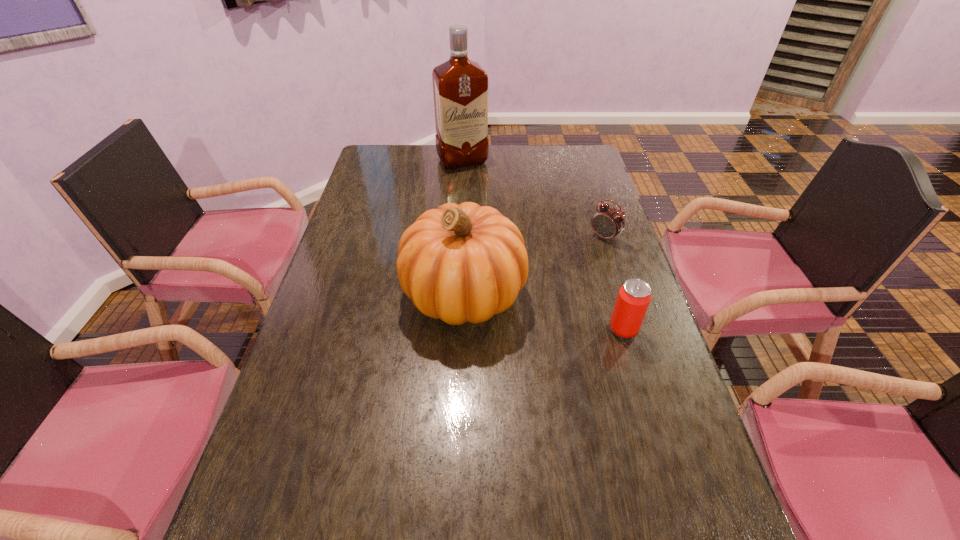
Where is `free point at the far left corner`? This screenshot has height=540, width=960. free point at the far left corner is located at coordinates (384, 152).

The width and height of the screenshot is (960, 540). I want to click on vacant region at the far right corner, so 561,160.

This screenshot has width=960, height=540. Find the location of `vacant space at the near right corner of the desktop`. vacant space at the near right corner of the desktop is located at coordinates (668, 498).

Identify the location of free spot between the alarm clock and the tallest object. The image size is (960, 540). (534, 199).

The image size is (960, 540). In order to click on free spot between the beer can and the tallest object in this screenshot , I will do `click(542, 245)`.

Locate an element on the screen. The height and width of the screenshot is (540, 960). free spot between the tallest object and the second farthest object is located at coordinates (534, 199).

Find the location of `free spot between the beer can and the third shortest object`. free spot between the beer can and the third shortest object is located at coordinates (543, 312).

What are the coordinates of `vacant space that's between the third shortest object and the third nearest object` in the screenshot? It's located at (534, 266).

Where is `free space between the beer can and the alarm clock`? free space between the beer can and the alarm clock is located at coordinates (613, 283).

Locate an element on the screen. The image size is (960, 540). unoccupied area between the second tallest object and the alarm clock is located at coordinates (534, 266).